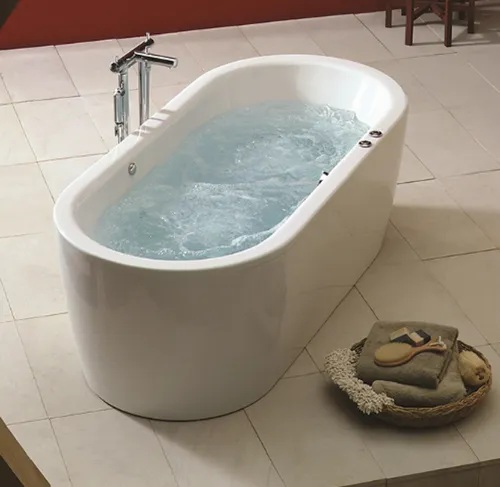
The height and width of the screenshot is (487, 500). I want to click on faucet, so click(145, 61).